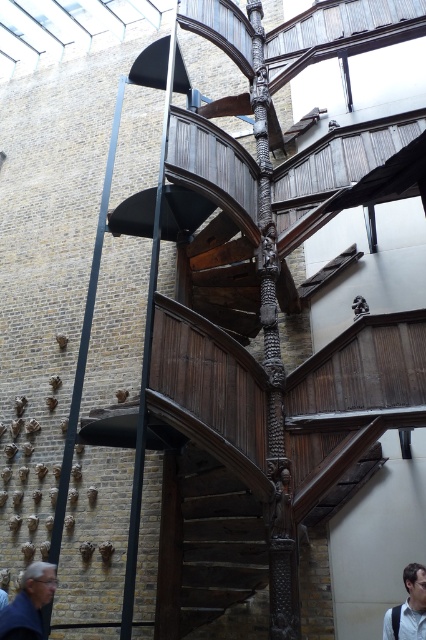
In the scene shown: You are an interior designer assessing the space for a new sculpture. The sculpture requires a support structure that is narrower than the black metal pole at left. Can the gray hair at lower left be used as a support? Please explain.

The black metal pole at left is wider than the gray hair at lower left. Since the sculpture needs a support narrower than the black metal pole at left, the gray hair at lower left can be used as a support because it is narrower.

You are an architect designing a new building and want to incorporate two black metal poles in the design. You have a limited budget and can only use one type of metal pole. Based on the image, which pole would be more cost effective to replicate, the black metal pole at center or the black metal pole at left?

The black metal pole at center is thinner than the black metal pole at left, so replicating the black metal pole at center would be more cost effective as it requires less material.